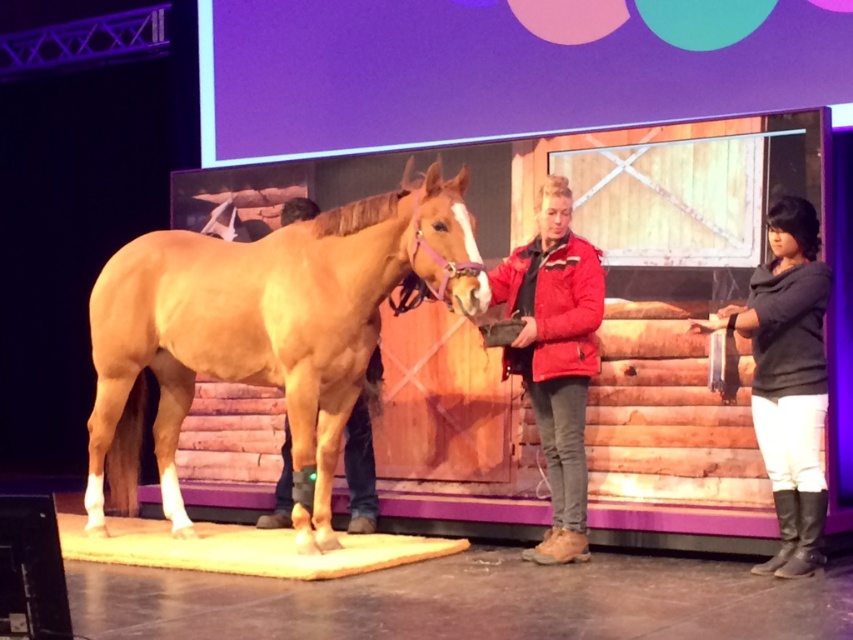
This screenshot has width=853, height=640. Find the location of `dark gray sweater at right`. dark gray sweater at right is located at coordinates (788, 380).

Who is taller, dark gray sweater at right or red jacket at center?

red jacket at center

Who is more forward, (759, 291) or (579, 560)?

Point (759, 291)

The image size is (853, 640). Find the location of `dark gray sweater at right`. dark gray sweater at right is located at coordinates (788, 380).

Is golden-brown leather horse at center smaller than red jacket at center?

Actually, golden-brown leather horse at center might be larger than red jacket at center.

Who is higher up, golden-brown leather horse at center or red jacket at center?

Positioned higher is red jacket at center.

At what (x,y) coordinates should I click in order to perform the action: click on golden-brown leather horse at center. Please return your answer as a coordinate pair (x, y). Image resolution: width=853 pixels, height=640 pixels. Looking at the image, I should click on click(265, 332).

Where is `golden-brown leather horse at center`? golden-brown leather horse at center is located at coordinates (265, 332).

Is golden-brown leather horse at center above dark gray sweater at right?

Actually, golden-brown leather horse at center is below dark gray sweater at right.

Based on the photo, is golden-brown leather horse at center taller than dark gray sweater at right?

Yes, golden-brown leather horse at center is taller than dark gray sweater at right.

This screenshot has width=853, height=640. What are the coordinates of `golden-brown leather horse at center` in the screenshot? It's located at (265, 332).